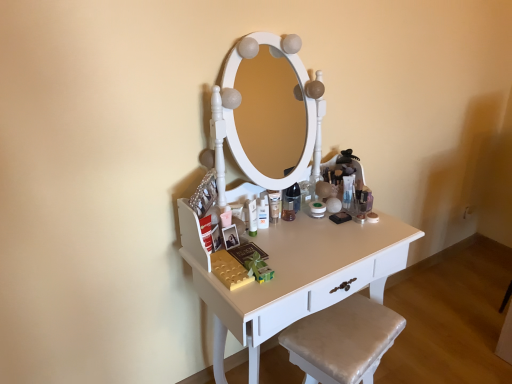
The image size is (512, 384). What are the coordinates of `blank space above satin beige cushion at lower right (from a real-world perspective)` in the screenshot? It's located at (344, 330).